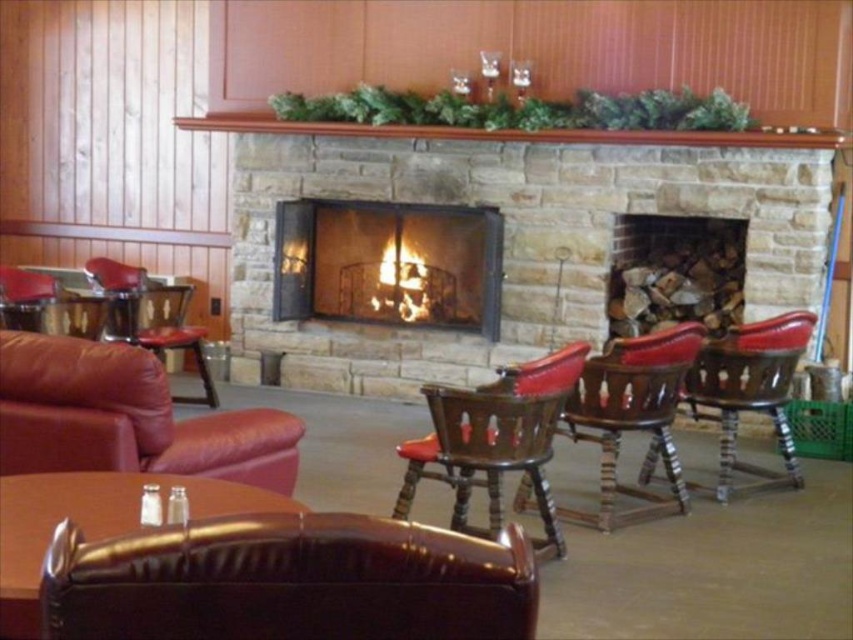
Question: Is leather couch at left wider than shiny brown leather table at lower left?

Choices:
 (A) yes
 (B) no

Answer: (A)

Question: Which object is closer to the camera taking this photo?

Choices:
 (A) leather seat at center
 (B) brown leather swivel chair at center
 (C) stone fireplace at center
 (D) leather couch at left

Answer: (B)

Question: Does brown leather swivel chair at center appear on the right side of stone fireplace at center?

Choices:
 (A) no
 (B) yes

Answer: (B)

Question: Does brown leather swivel chair at center appear under leather armchair at center?

Choices:
 (A) yes
 (B) no

Answer: (B)

Question: Which object is the farthest from the leather seat at center?

Choices:
 (A) shiny brown leather table at lower left
 (B) brown leather swivel chair at center
 (C) leather armchair at center

Answer: (B)

Question: Which is farther from the leather seat at center?

Choices:
 (A) leather armchair at center
 (B) stone fireplace at center

Answer: (B)